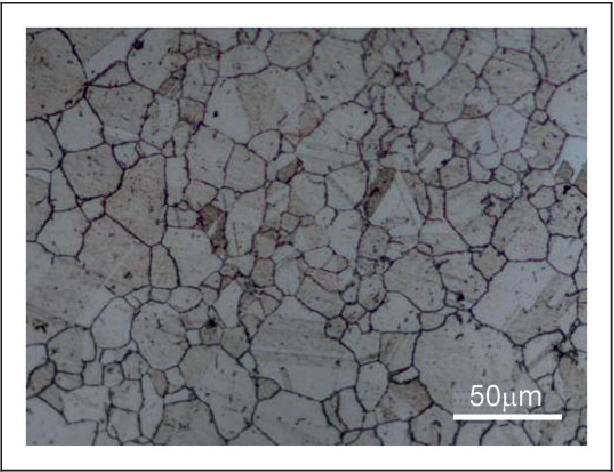
Where is `frame`? The height and width of the screenshot is (472, 614). frame is located at coordinates (x=424, y=463).